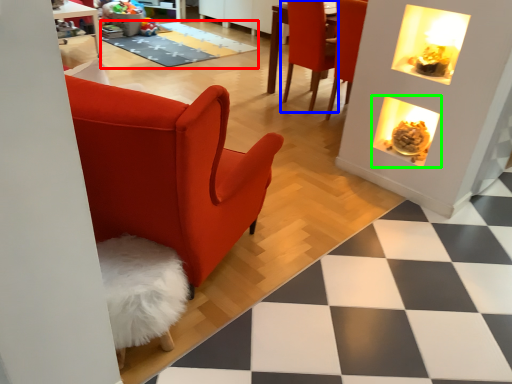
Question: Considering the real-world distances, which object is closest to mat (highlighted by a red box)? chair (highlighted by a blue box) or fireplace (highlighted by a green box).

Choices:
 (A) chair
 (B) fireplace

Answer: (A)